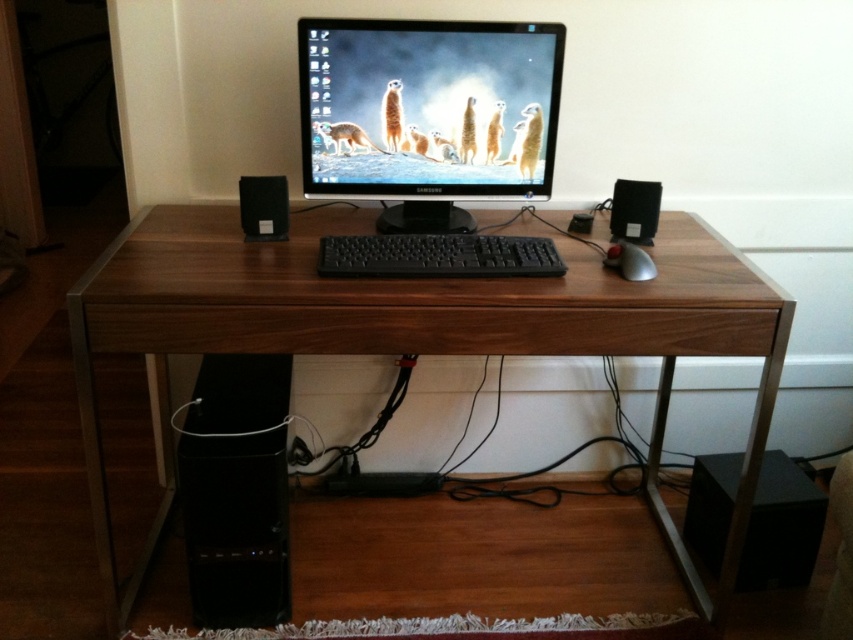
Which is below, matte black monitor at center or black matte speaker at left?

black matte speaker at left

Describe the element at coordinates (426, 106) in the screenshot. I see `matte black monitor at center` at that location.

The width and height of the screenshot is (853, 640). Find the location of `matte black monitor at center`. matte black monitor at center is located at coordinates (426, 106).

The height and width of the screenshot is (640, 853). I want to click on walnut wood desk at center, so click(412, 330).

Does walnut wood desk at center have a greater width compared to black plastic speaker at right?

Yes, walnut wood desk at center is wider than black plastic speaker at right.

This screenshot has width=853, height=640. Identify the location of walnut wood desk at center. (412, 330).

Does matte black monitor at center have a greater width compared to black plastic speaker at right?

Correct, the width of matte black monitor at center exceeds that of black plastic speaker at right.

Between point (315, 124) and point (639, 212), which one is positioned behind?

Point (639, 212)

Identify the location of matte black monitor at center. The height and width of the screenshot is (640, 853). (426, 106).